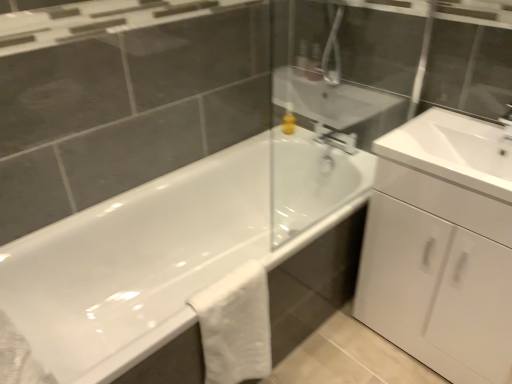
Question: Is point (289, 114) positioned closer to the camera than point (98, 266)?

Choices:
 (A) closer
 (B) farther

Answer: (B)

Question: Is yellow matte soap dispenser at upper center in front of or behind white glossy bathtub at center in the image?

Choices:
 (A) front
 (B) behind

Answer: (B)

Question: Which is nearer to the white glossy bathtub at center?

Choices:
 (A) yellow matte soap dispenser at upper center
 (B) white glossy cabinet at right
 (C) white cotton towel at lower center
 (D) white glossy sink at right

Answer: (C)

Question: Which object is positioned farthest from the white glossy bathtub at center?

Choices:
 (A) white cotton towel at lower center
 (B) yellow matte soap dispenser at upper center
 (C) white glossy sink at right
 (D) white glossy cabinet at right

Answer: (B)